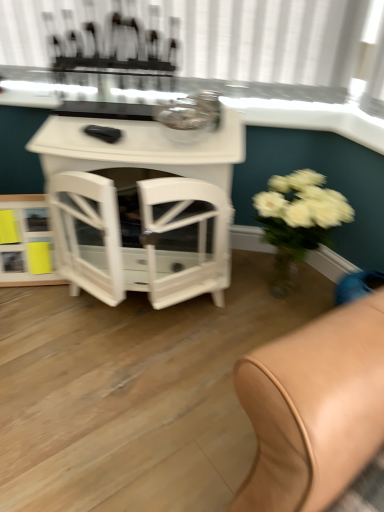
Question: Can you confirm if white glossy window sill at upper center is shorter than clear glass table at upper center?

Choices:
 (A) no
 (B) yes

Answer: (B)

Question: From the image's perspective, is white glossy window sill at upper center over clear glass table at upper center?

Choices:
 (A) yes
 (B) no

Answer: (B)

Question: Is white glossy window sill at upper center smaller than clear glass table at upper center?

Choices:
 (A) yes
 (B) no

Answer: (A)

Question: Considering the relative sizes of white glossy window sill at upper center and clear glass table at upper center in the image provided, is white glossy window sill at upper center bigger than clear glass table at upper center?

Choices:
 (A) no
 (B) yes

Answer: (A)

Question: Does white glossy window sill at upper center come behind clear glass table at upper center?

Choices:
 (A) no
 (B) yes

Answer: (B)

Question: From the image's perspective, is clear glass table at upper center above or below white glossy table at center?

Choices:
 (A) above
 (B) below

Answer: (A)

Question: From a real-world perspective, is clear glass table at upper center physically located above or below white glossy table at center?

Choices:
 (A) above
 (B) below

Answer: (A)

Question: Considering the positions of clear glass table at upper center and white glossy table at center in the image, is clear glass table at upper center wider or thinner than white glossy table at center?

Choices:
 (A) thin
 (B) wide

Answer: (A)

Question: In terms of size, does clear glass table at upper center appear bigger or smaller than white glossy table at center?

Choices:
 (A) small
 (B) big

Answer: (A)

Question: Looking at their shapes, would you say white glossy table at center is wider or thinner than white glossy window sill at upper center?

Choices:
 (A) wide
 (B) thin

Answer: (A)

Question: In the image, is white glossy table at center on the left side or the right side of white glossy window sill at upper center?

Choices:
 (A) left
 (B) right

Answer: (A)

Question: From a real-world perspective, is white glossy table at center physically located above or below white glossy window sill at upper center?

Choices:
 (A) below
 (B) above

Answer: (A)

Question: In terms of height, does white glossy table at center look taller or shorter compared to white glossy window sill at upper center?

Choices:
 (A) short
 (B) tall

Answer: (B)

Question: Looking at the image, does white glossy shelf at lower left seem bigger or smaller compared to white glossy table at center?

Choices:
 (A) small
 (B) big

Answer: (A)

Question: Considering their positions, is white glossy shelf at lower left located in front of or behind white glossy table at center?

Choices:
 (A) behind
 (B) front

Answer: (A)